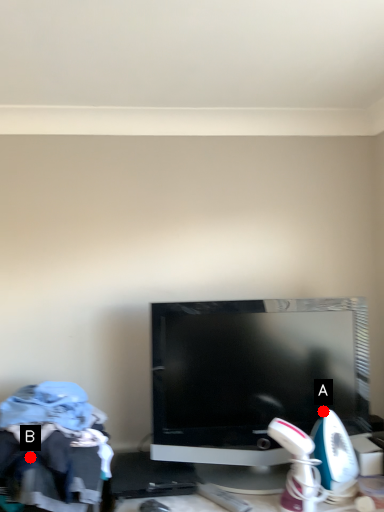
Question: Two points are circled on the image, labeled by A and B beside each circle. Which point is further to the camera?

Choices:
 (A) A is further
 (B) B is further

Answer: (A)